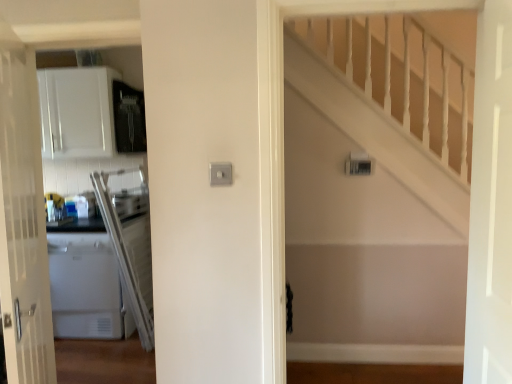
Question: Could you tell me if white glossy door at right, arranged as the first door when viewed from the right, is facing white glossy door at left, which appears as the second door when viewed from the right?

Choices:
 (A) no
 (B) yes

Answer: (B)

Question: Can you confirm if white glossy door at right, the 2th door positioned from the left, is bigger than white glossy door at left, which appears as the second door when viewed from the right?

Choices:
 (A) no
 (B) yes

Answer: (A)

Question: Considering the relative sizes of white glossy door at right, the 2th door positioned from the left, and white glossy door at left, which is the 1th door from left to right, in the image provided, is white glossy door at right, the 2th door positioned from the left, wider than white glossy door at left, which is the 1th door from left to right,?

Choices:
 (A) yes
 (B) no

Answer: (B)

Question: Is white glossy door at right, arranged as the first door when viewed from the right, touching white glossy door at left, which is the 1th door from left to right?

Choices:
 (A) yes
 (B) no

Answer: (B)

Question: From the image's perspective, is white glossy door at right, arranged as the first door when viewed from the right, located beneath white glossy door at left, which appears as the second door when viewed from the right?

Choices:
 (A) yes
 (B) no

Answer: (B)

Question: In the image, is white glossy door at right, the 2th door positioned from the left, positioned in front of or behind white wooden staircase at upper right?

Choices:
 (A) front
 (B) behind

Answer: (A)

Question: Is point (500, 210) closer or farther from the camera than point (418, 160)?

Choices:
 (A) closer
 (B) farther

Answer: (A)

Question: Is white glossy door at right, the 2th door positioned from the left, inside the boundaries of white wooden staircase at upper right, or outside?

Choices:
 (A) outside
 (B) inside

Answer: (A)

Question: Is white glossy door at right, arranged as the first door when viewed from the right, taller or shorter than white wooden staircase at upper right?

Choices:
 (A) tall
 (B) short

Answer: (B)

Question: Based on their sizes in the image, would you say white wooden staircase at upper right is bigger or smaller than white glossy door at right, the 2th door positioned from the left?

Choices:
 (A) big
 (B) small

Answer: (A)

Question: Looking at their shapes, would you say white wooden staircase at upper right is wider or thinner than white glossy door at right, the 2th door positioned from the left?

Choices:
 (A) wide
 (B) thin

Answer: (A)

Question: Which is correct: white wooden staircase at upper right is inside white glossy door at right, the 2th door positioned from the left, or outside of it?

Choices:
 (A) inside
 (B) outside

Answer: (B)

Question: From the image's perspective, is white wooden staircase at upper right above or below white glossy door at right, the 2th door positioned from the left?

Choices:
 (A) below
 (B) above

Answer: (B)

Question: Considering the positions of white glossy door at right, the 2th door positioned from the left, and white glossy door at left, which appears as the second door when viewed from the right, in the image, is white glossy door at right, the 2th door positioned from the left, taller or shorter than white glossy door at left, which appears as the second door when viewed from the right,?

Choices:
 (A) short
 (B) tall

Answer: (A)

Question: From the image's perspective, is white glossy door at right, the 2th door positioned from the left, located above or below white glossy door at left, which appears as the second door when viewed from the right?

Choices:
 (A) above
 (B) below

Answer: (A)